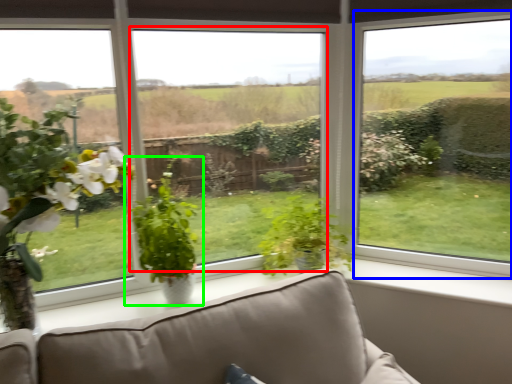
Question: Considering the real-world distances, which object is farthest from window screen (highlighted by a red box)? window (highlighted by a blue box) or houseplant (highlighted by a green box)?

Choices:
 (A) window
 (B) houseplant

Answer: (A)